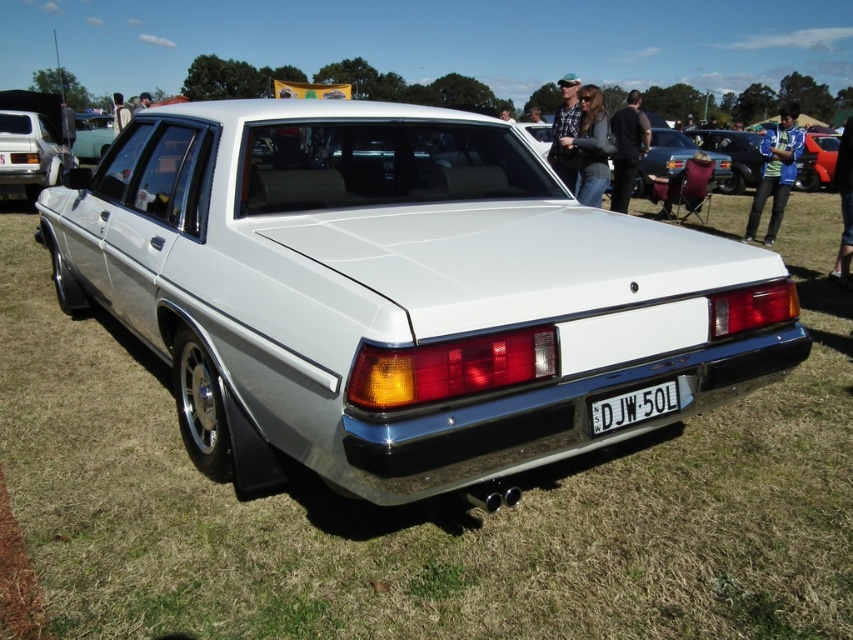
Can you confirm if black plastic license plate at center is smaller than matte white sedan at center?

Correct, black plastic license plate at center occupies less space than matte white sedan at center.

Who is taller, black plastic license plate at center or matte white sedan at center?

matte white sedan at center is taller.

Does point (624, 401) come farther from viewer compared to point (109, 140)?

No, (624, 401) is in front of (109, 140).

Identify the location of black plastic license plate at center. (633, 406).

Is matte white sedan at left bigger than matte white sedan at center?

Actually, matte white sedan at left might be smaller than matte white sedan at center.

Describe the element at coordinates (30, 154) in the screenshot. I see `matte white sedan at left` at that location.

Image resolution: width=853 pixels, height=640 pixels. Identify the location of matte white sedan at left. (30, 154).

Between white glossy sedan at center and matte white sedan at center, which one has less height?

white glossy sedan at center is shorter.

Who is taller, white glossy sedan at center or matte white sedan at center?

matte white sedan at center

What do you see at coordinates (398, 292) in the screenshot? The width and height of the screenshot is (853, 640). I see `white glossy sedan at center` at bounding box center [398, 292].

Locate an element on the screen. white glossy sedan at center is located at coordinates (398, 292).